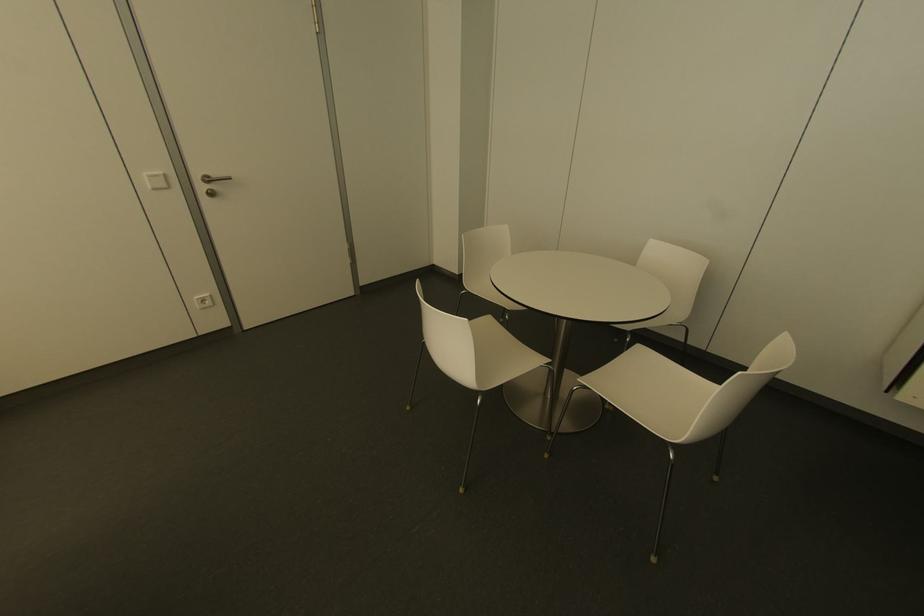
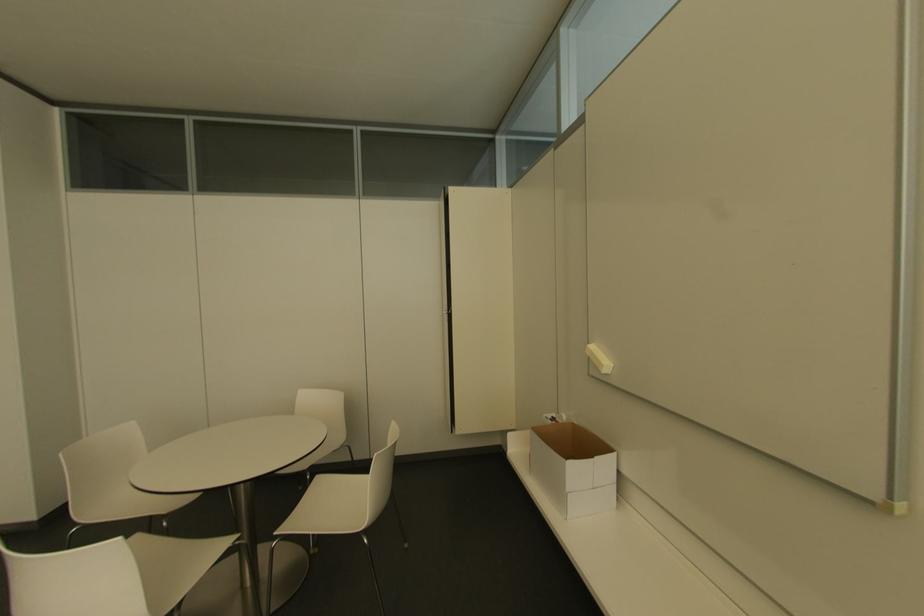
Question: Based on the continuous images, in which direction is the camera rotating? Reply with the corresponding letter.

Choices:
 (A) Left
 (B) Right
 (C) Up
 (D) Down

Answer: (B)